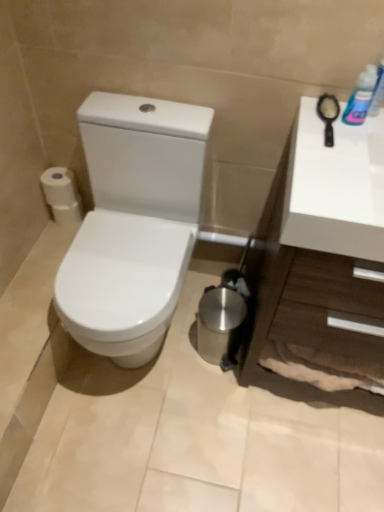
Question: Looking at the image, does white glossy countertop at right seem bigger or smaller compared to blue plastic bottle at upper right?

Choices:
 (A) small
 (B) big

Answer: (B)

Question: Is white glossy countertop at right taller or shorter than blue plastic bottle at upper right?

Choices:
 (A) short
 (B) tall

Answer: (B)

Question: Which object is the farthest from the white glossy countertop at right?

Choices:
 (A) blue plastic bottle at upper right
 (B) white matte toilet paper at left
 (C) white glossy toilet at left

Answer: (B)

Question: Which of these objects is positioned closest to the white glossy toilet at left?

Choices:
 (A) white glossy countertop at right
 (B) blue plastic bottle at upper right
 (C) white matte toilet paper at left

Answer: (C)